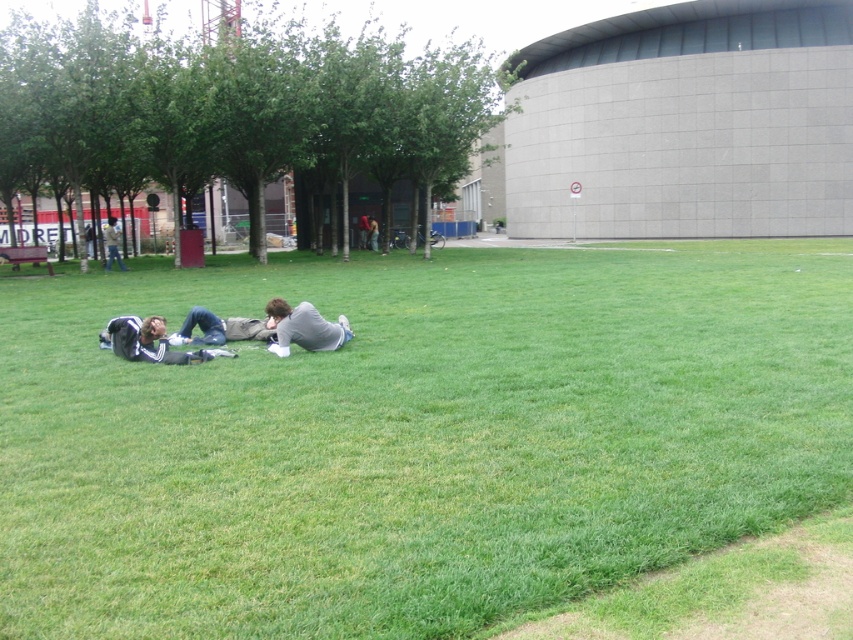
Question: Which of the following is the closest to the observer?

Choices:
 (A) dark gray fabric jacket at lower left
 (B) gray fabric jacket at center

Answer: (A)

Question: Is dark gray fabric jacket at lower left to the left of gray fabric shirt at center from the viewer's perspective?

Choices:
 (A) no
 (B) yes

Answer: (B)

Question: Estimate the real-world distances between objects in this image. Which object is closer to the gray fabric jacket at center?

Choices:
 (A) green grass at lower left
 (B) gray fabric shirt at center

Answer: (A)

Question: Estimate the real-world distances between objects in this image. Which object is closer to the gray fabric jacket at center?

Choices:
 (A) green grass at lower left
 (B) gray fabric shirt at center
 (C) dark gray fabric jacket at lower left

Answer: (A)

Question: Does dark gray fabric jacket at lower left have a smaller size compared to gray fabric jacket at center?

Choices:
 (A) no
 (B) yes

Answer: (B)

Question: In this image, where is gray fabric shirt at center located relative to gray fabric jacket at center?

Choices:
 (A) left
 (B) right

Answer: (B)